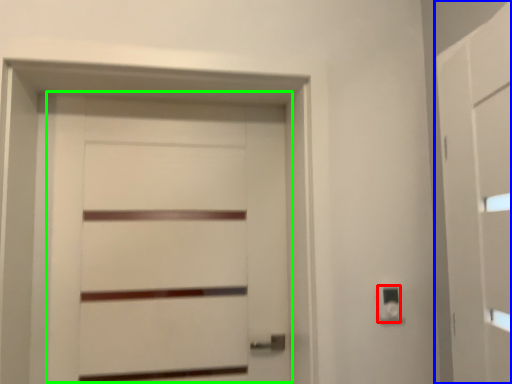
Question: Based on their relative distances, which object is nearer to light switch (highlighted by a red box)? Choose from barn door (highlighted by a blue box) and door (highlighted by a green box).

Choices:
 (A) barn door
 (B) door

Answer: (A)